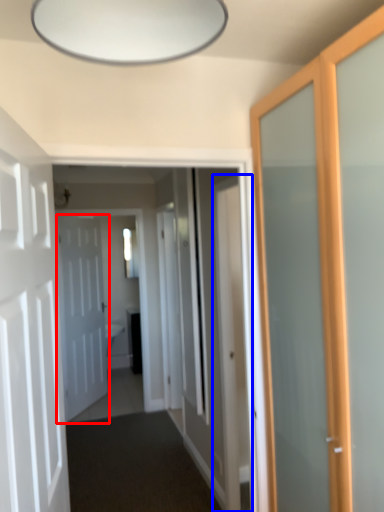
Question: Which of the following is the closest to the observer, door (highlighted by a red box) or door (highlighted by a blue box)?

Choices:
 (A) door
 (B) door

Answer: (B)